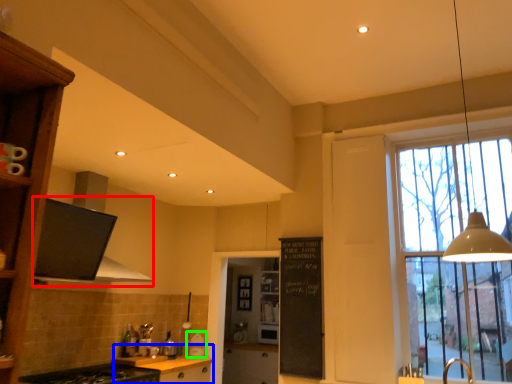
Question: Considering the real-world distances, which object is closest to exhaust hood (highlighted by a red box)? cabinetry (highlighted by a blue box) or appliance (highlighted by a green box).

Choices:
 (A) cabinetry
 (B) appliance

Answer: (A)